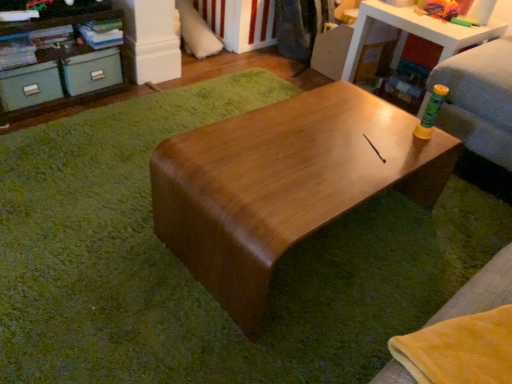
Locate an element on the screen. This screenshot has height=384, width=512. free space above matte green drawer at left, the 1th drawer from the right (from a real-world perspective) is located at coordinates (92, 49).